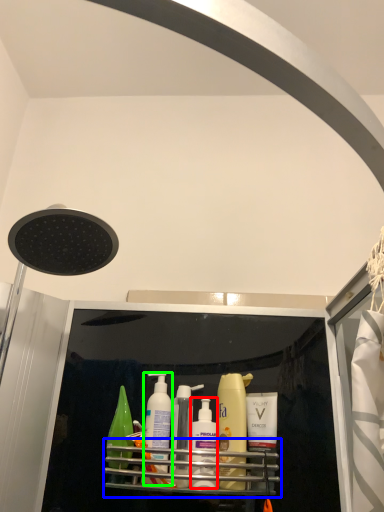
Question: Considering the real-world distances, which object is farthest from toiletry (highlighted by a red box)? shelf (highlighted by a blue box) or cleaning product (highlighted by a green box)?

Choices:
 (A) shelf
 (B) cleaning product

Answer: (B)